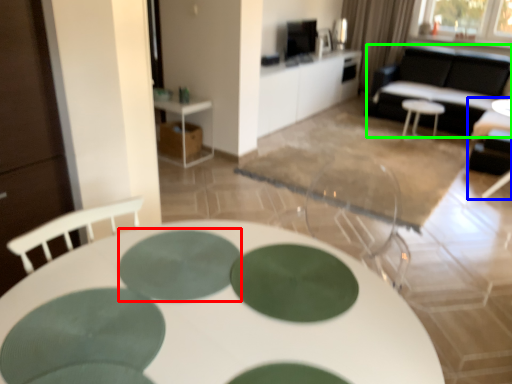
Question: Based on their relative distances, which object is farther from oval (highlighted by a red box)? Choose from chair (highlighted by a blue box) and couch (highlighted by a green box).

Choices:
 (A) chair
 (B) couch

Answer: (B)